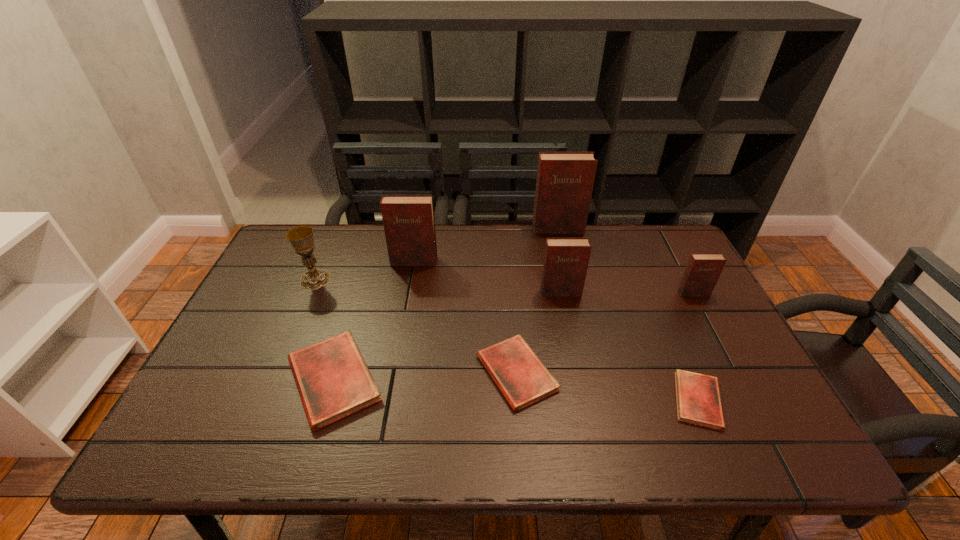
Select which diary appears as the second closest to the sixth tallest diary. Please provide its 2D coordinates. Your answer should be formatted as a tuple, i.e. [(x, y)], where the tuple contains the x and y coordinates of a point satisfying the conditions above.

[(333, 381)]

Point out which diary is positioned as the second nearest to the sixth nearest diary. Please provide its 2D coordinates. Your answer should be formatted as a tuple, i.e. [(x, y)], where the tuple contains the x and y coordinates of a point satisfying the conditions above.

[(523, 379)]

Identify which reddish-brown diary is the third closest to the farthest object. Please provide its 2D coordinates. Your answer should be formatted as a tuple, i.e. [(x, y)], where the tuple contains the x and y coordinates of a point satisfying the conditions above.

[(703, 270)]

This screenshot has height=540, width=960. Identify the location of the third closest reddish-brown diary relative to the leftmost red diary. (565, 180).

At what (x,y) coordinates should I click in order to perform the action: click on the closest red diary relative to the seventh object from left to right. Please return your answer as a coordinate pair (x, y). Image resolution: width=960 pixels, height=540 pixels. Looking at the image, I should click on (523, 379).

You are a GUI agent. You are given a task and a screenshot of the screen. Output one action in this format:
    pyautogui.click(x=<x>, y=<y>)
    Task: Click on the red diary that is the closest to the seventh object from left to right
    This screenshot has width=960, height=540.
    Given the screenshot: What is the action you would take?
    pyautogui.click(x=523, y=379)

Locate an element on the screen. This screenshot has width=960, height=540. blank area in the image that satisfies the following two spatial constraints: 1. on the front cover of the seventh object from left to right; 2. on the left side of the third tallest diary is located at coordinates (583, 400).